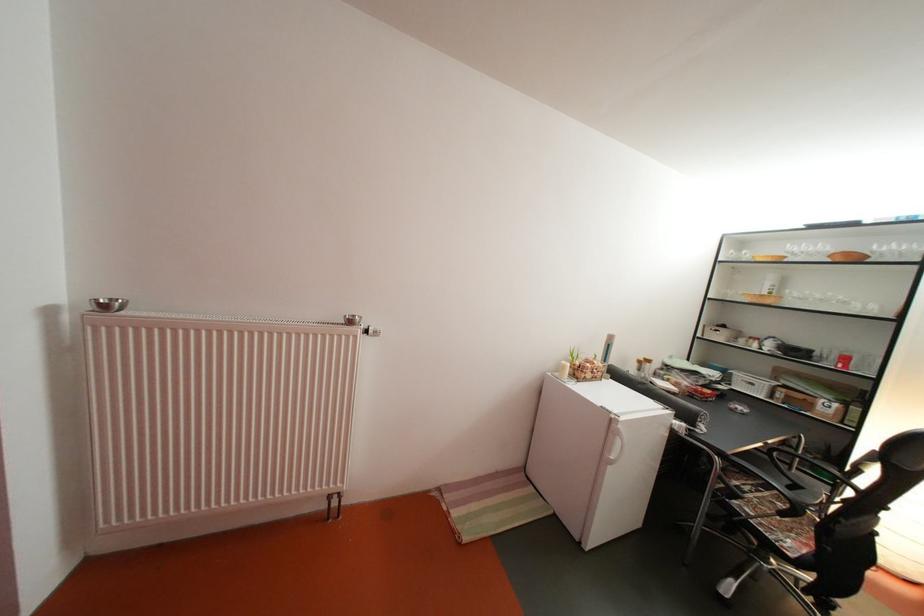
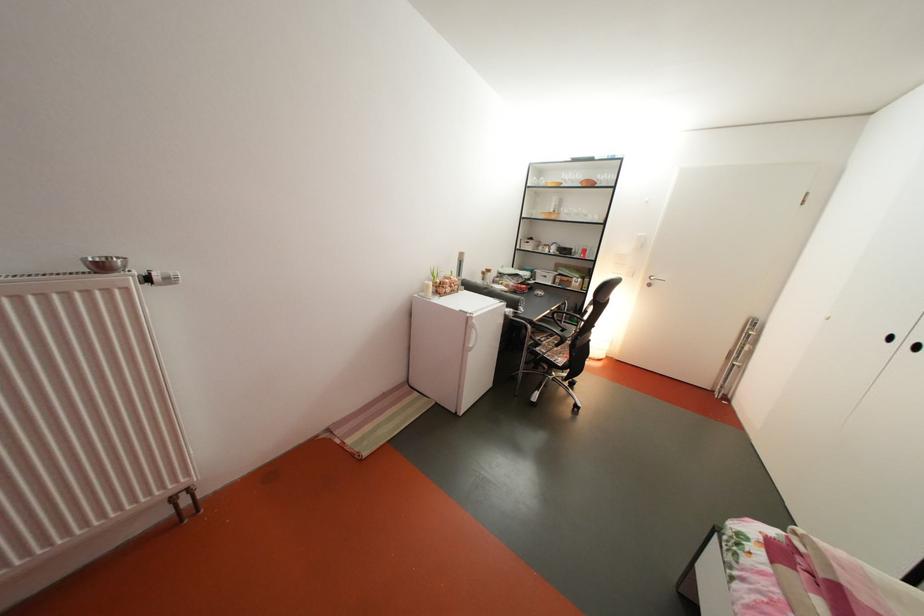
The point at (359, 325) is marked in the first image. Where is the corresponding point in the second image?

(107, 270)